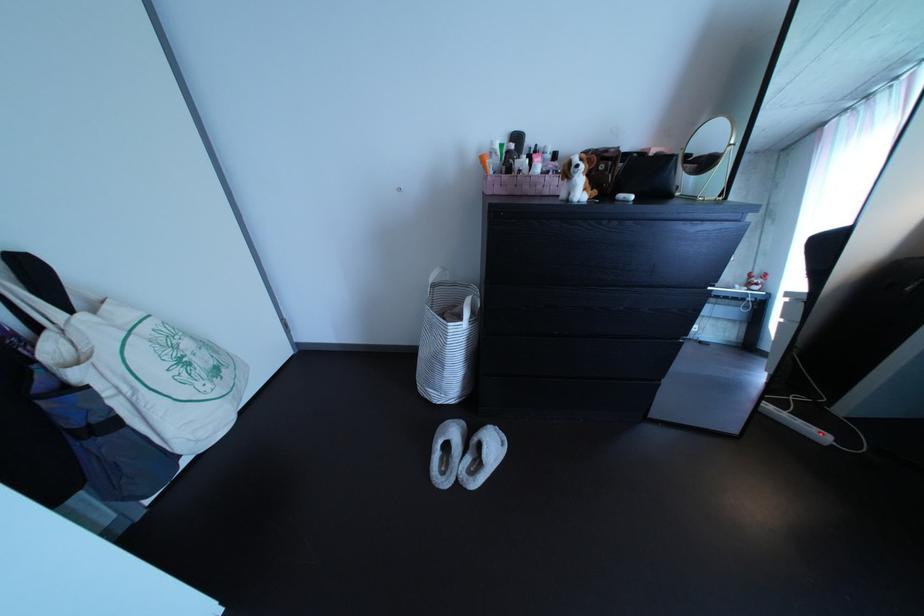
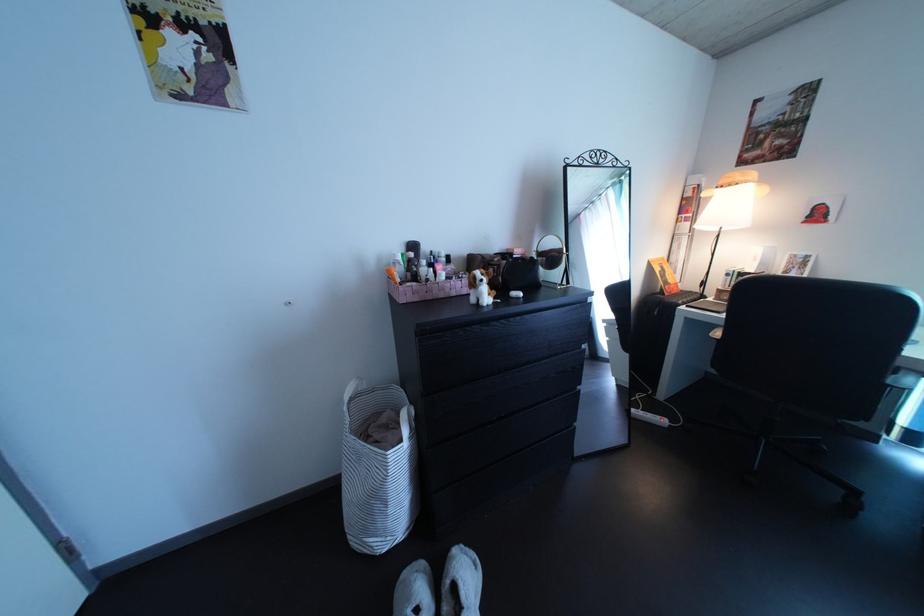
Where in the second image is the point corresponding to the point at 468,440 from the first image?

(432, 596)